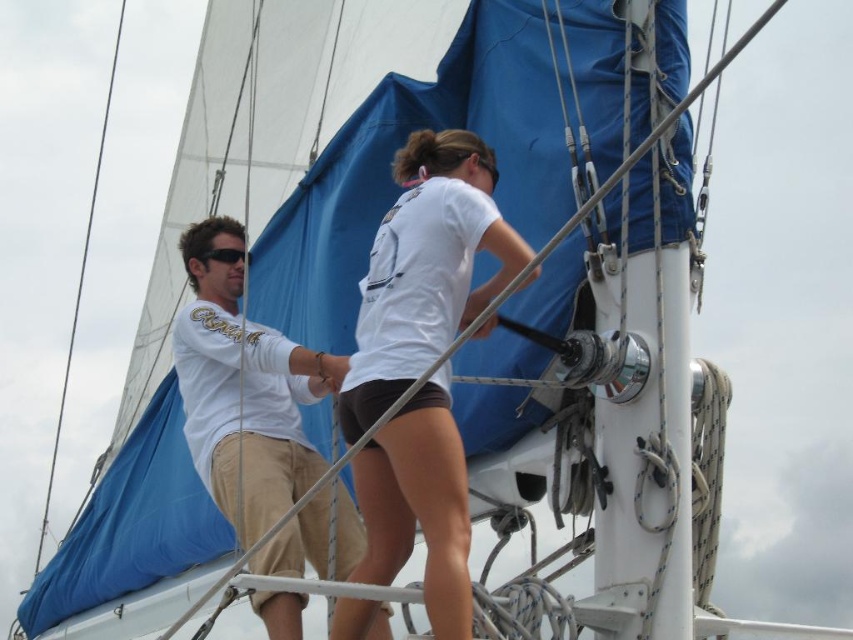
Question: Which point is farther to the camera?

Choices:
 (A) (213, 259)
 (B) (224, 465)
 (C) (363, 417)

Answer: (A)

Question: Is white cotton shirt at center closer to the viewer compared to black plastic sunglasses at left?

Choices:
 (A) yes
 (B) no

Answer: (A)

Question: Estimate the real-world distances between objects in this image. Which object is closer to the white matte shorts at center?

Choices:
 (A) white cotton shirt at center
 (B) black plastic sunglasses at left

Answer: (A)

Question: Which is nearer to the white matte shorts at center?

Choices:
 (A) black plastic sunglasses at left
 (B) white cotton shirt at center

Answer: (B)

Question: Does white matte shorts at center have a lesser width compared to black plastic sunglasses at left?

Choices:
 (A) no
 (B) yes

Answer: (A)

Question: Does white matte shorts at center have a greater width compared to black plastic sunglasses at left?

Choices:
 (A) no
 (B) yes

Answer: (B)